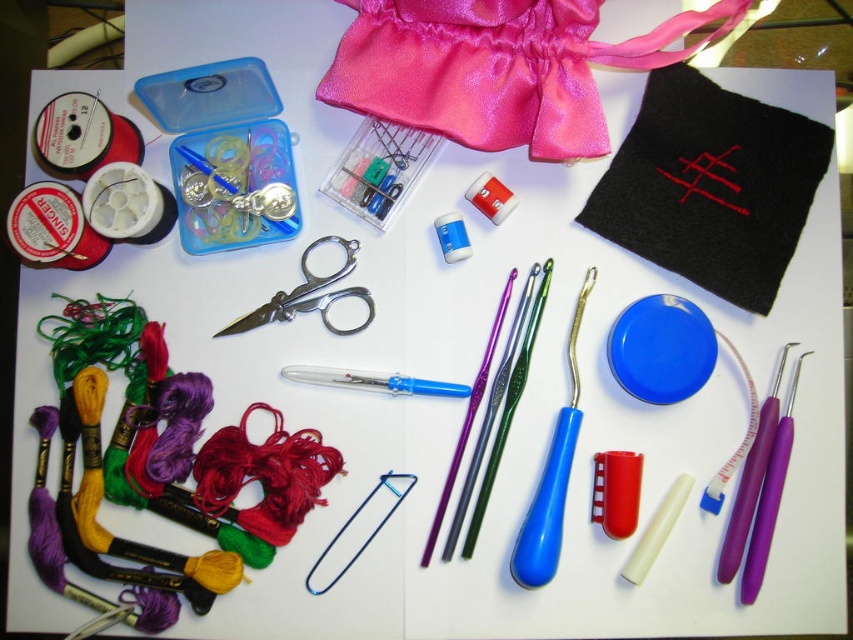
Question: Observing the image, what is the correct spatial positioning of shiny pink fabric at upper center in reference to metallic silver crochet hook at center?

Choices:
 (A) above
 (B) below

Answer: (A)

Question: Does shiny pink fabric at upper center have a lesser width compared to metallic scissors at center?

Choices:
 (A) yes
 (B) no

Answer: (B)

Question: Among these objects, which one is nearest to the camera?

Choices:
 (A) metallic scissors at center
 (B) shiny pink fabric at upper center
 (C) metallic silver crochet hook at center

Answer: (B)

Question: Where is shiny pink fabric at upper center located in relation to metallic scissors at center in the image?

Choices:
 (A) right
 (B) left

Answer: (A)

Question: Based on their relative distances, which object is farther from the metallic silver crochet hook at center?

Choices:
 (A) shiny pink fabric at upper center
 (B) metallic scissors at center

Answer: (A)

Question: Which object is farther from the camera taking this photo?

Choices:
 (A) metallic silver crochet hook at center
 (B) metallic scissors at center
 (C) shiny pink fabric at upper center

Answer: (B)